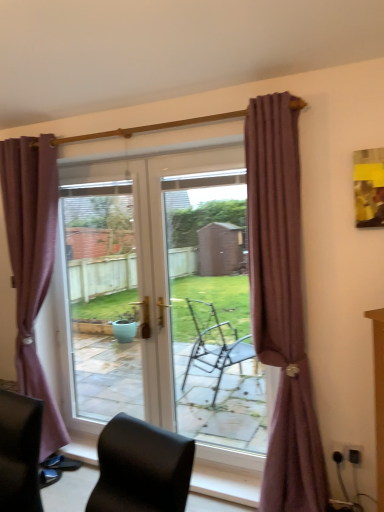
Question: Do you think black leather chair at lower left is within transparent glass door at center, or outside of it?

Choices:
 (A) inside
 (B) outside

Answer: (B)

Question: From the image's perspective, is black leather chair at lower left above or below transparent glass door at center?

Choices:
 (A) above
 (B) below

Answer: (B)

Question: Which object is positioned closest to the mauve fabric curtain at right, which is the second curtain from back to front?

Choices:
 (A) transparent glass door at center
 (B) purple fabric curtain at left, which ranks as the 2th curtain in front-to-back order
 (C) transparent glass door at center
 (D) black leather chair at lower left

Answer: (D)

Question: Estimate the real-world distances between objects in this image. Which object is farther from the mauve fabric curtain at right, the 1th curtain viewed from the front?

Choices:
 (A) purple fabric curtain at left, the 2th curtain when ordered from right to left
 (B) transparent glass door at center
 (C) transparent glass door at center
 (D) black leather chair at lower left

Answer: (C)